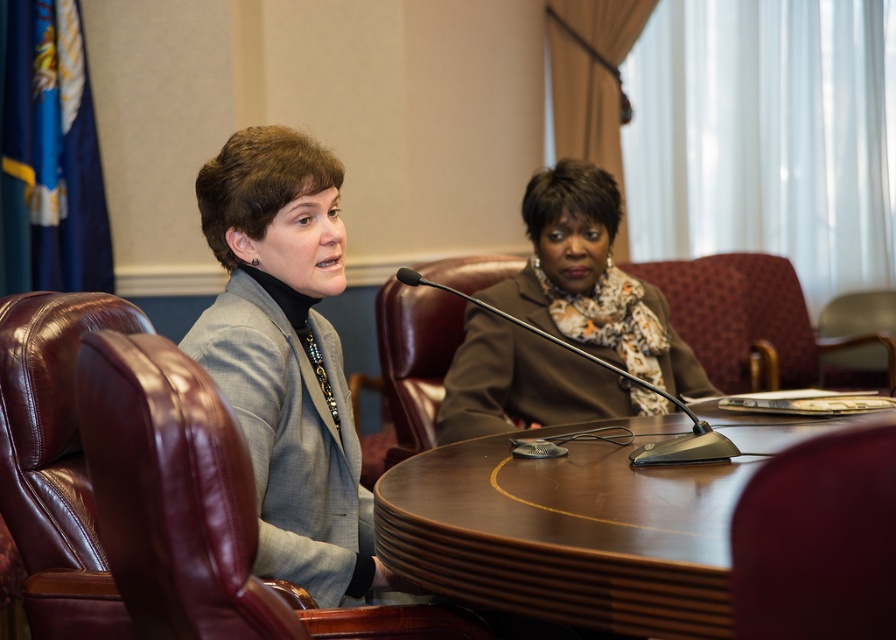
From the picture: You are a photographer standing in front of the brown wood table at center and the gray fabric jacket at center. You need to place a 12cm tall vase on the table. Will the vase be taller than the table?

The brown wood table at center is not as tall as gray fabric jacket at center. Since the vase is 12cm tall, but we don not know the exact height of the table or the jacket, we cannot determine if the vase will be taller than the table.

You are a person who is 1.8 meters tall and want to sit in the leather chair at left to reach the black plastic microphone at center. Will your head hit the ceiling if you sit there?

The leather chair at left is taller than the black plastic microphone at center, but the height of the ceiling isn not mentioned in the scene description. It is impossible to determine if your head will hit the ceiling.

You are an interior designer assessing the seating arrangement in the image. The gray fabric jacket at center and the shiny brown leather chair at left are part of the design. Which object is taller?

The gray fabric jacket at center is taller than the shiny brown leather chair at left.